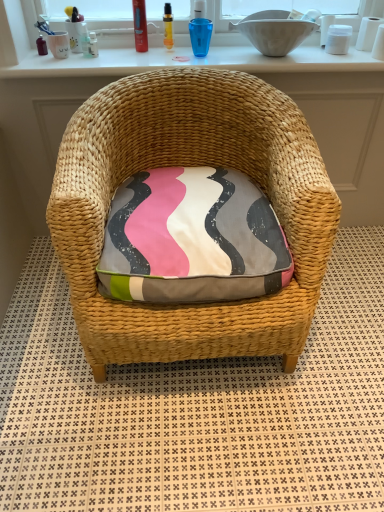
You are a GUI agent. You are given a task and a screenshot of the screen. Output one action in this format:
    pyautogui.click(x=<x>, y=<y>)
    Task: Click on the free space between translucent plastic toothbrush at upper center, the third toiletry when ordered from right to left, and shiny red can at upper center, marked as the second toiletry in a left-to-right arrangement
    Image resolution: width=384 pixels, height=512 pixels.
    Given the screenshot: What is the action you would take?
    pyautogui.click(x=115, y=54)